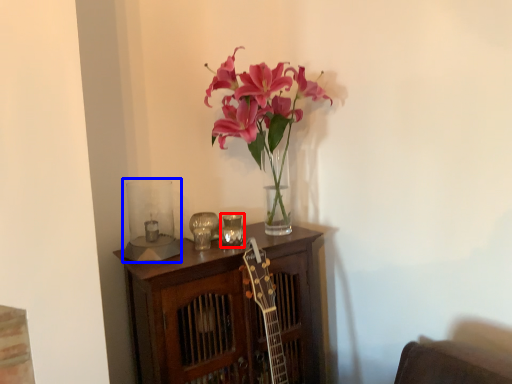
Question: Among these objects, which one is nearest to the camera, candle holder (highlighted by a red box) or candle holder (highlighted by a blue box)?

Choices:
 (A) candle holder
 (B) candle holder

Answer: (B)